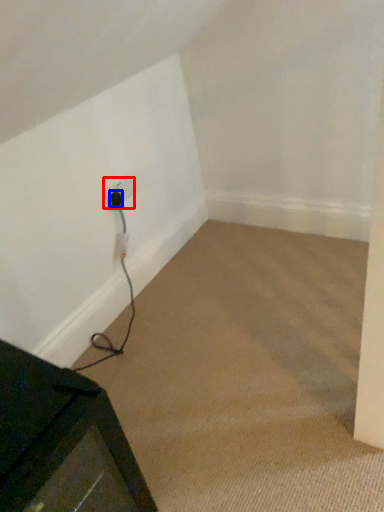
Question: Which object appears farthest to the camera in this image, electric outlet (highlighted by a red box) or plug (highlighted by a blue box)?

Choices:
 (A) electric outlet
 (B) plug

Answer: (B)